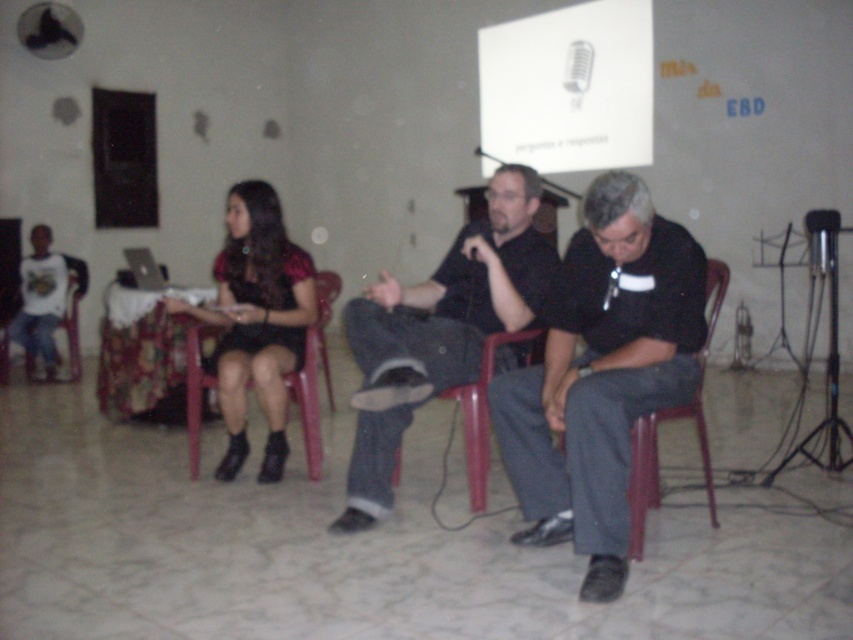
Question: Does dark gray pants at center appear over dark gray jeans at center?

Choices:
 (A) yes
 (B) no

Answer: (B)

Question: Does dark gray pants at center have a larger size compared to matte plastic chair at left?

Choices:
 (A) yes
 (B) no

Answer: (A)

Question: Among these points, which one is nearest to the camera?

Choices:
 (A) (471, 477)
 (B) (636, 531)

Answer: (B)

Question: Estimate the real-world distances between objects in this image. Which object is closer to the dark gray jeans at center?

Choices:
 (A) red plastic chair at lower right
 (B) matte plastic chair at left
 (C) dark gray pants at center
 (D) matte black dress at left

Answer: (C)

Question: Which point is closer to the camera?

Choices:
 (A) (221, 291)
 (B) (393, 460)

Answer: (B)

Question: Is dark gray jeans at center above matte black dress at left?

Choices:
 (A) no
 (B) yes

Answer: (A)